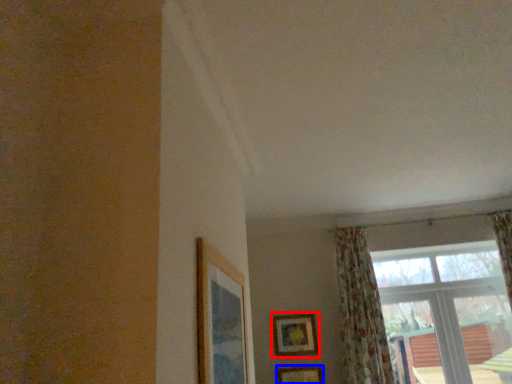
Question: Which object appears farthest to the camera in this image, picture frame (highlighted by a red box) or picture frame (highlighted by a blue box)?

Choices:
 (A) picture frame
 (B) picture frame

Answer: (A)